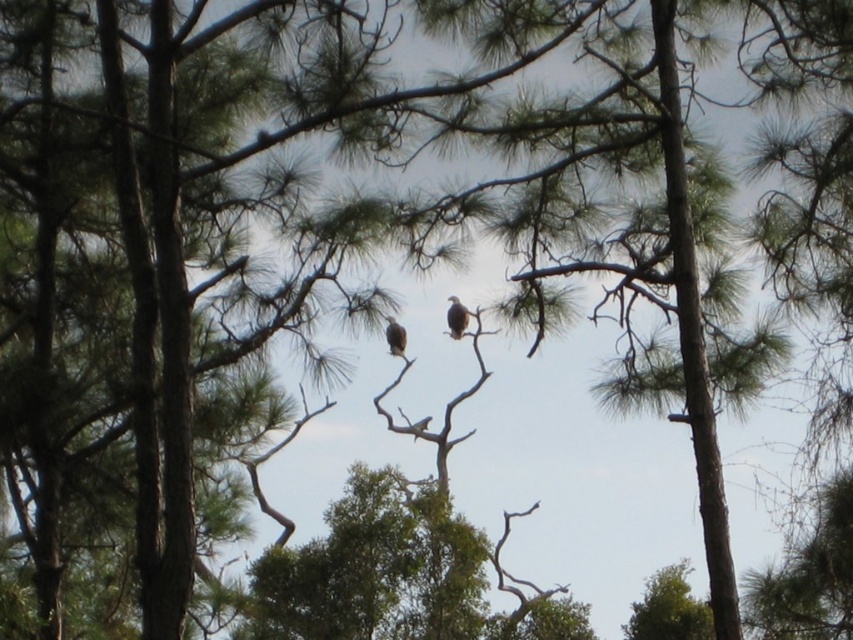
Who is more forward, (456, 298) or (396, 355)?

Point (456, 298)

Can you confirm if brown feathered bird at center is taller than brown feathered eagle at center?

Yes, brown feathered bird at center is taller than brown feathered eagle at center.

Locate an element on the screen. The image size is (853, 640). brown feathered bird at center is located at coordinates (457, 317).